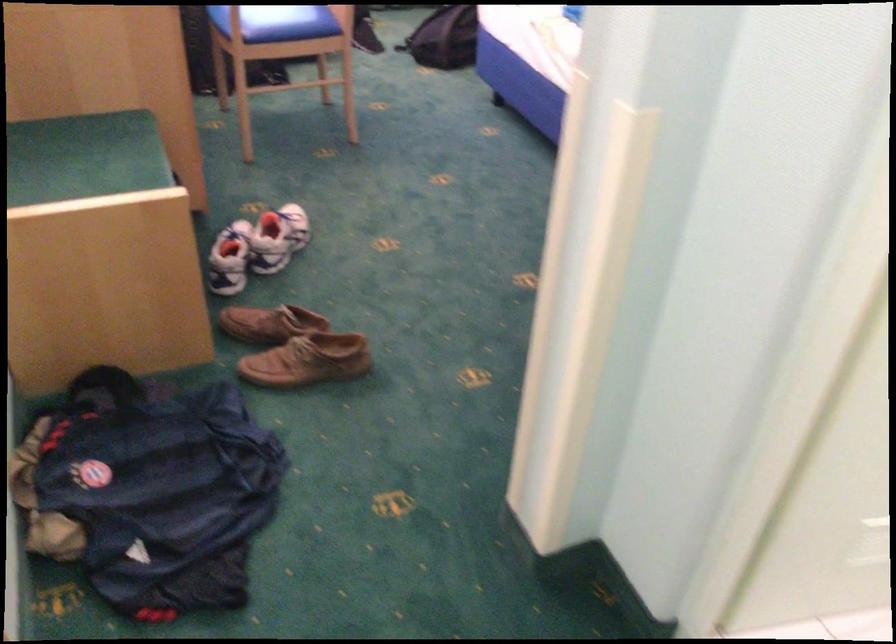
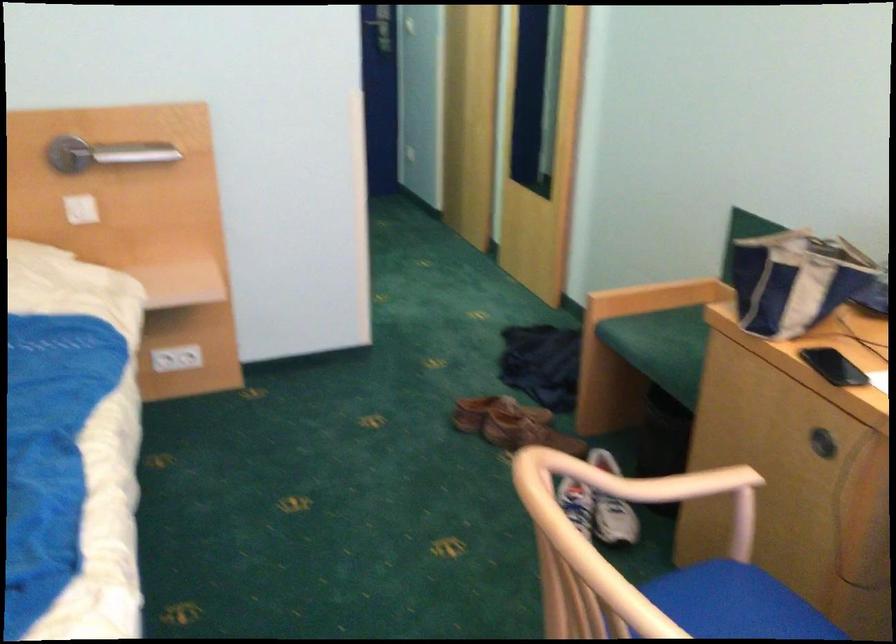
Find the pixel in the second image that matches point 250,237 in the first image.

(609, 542)